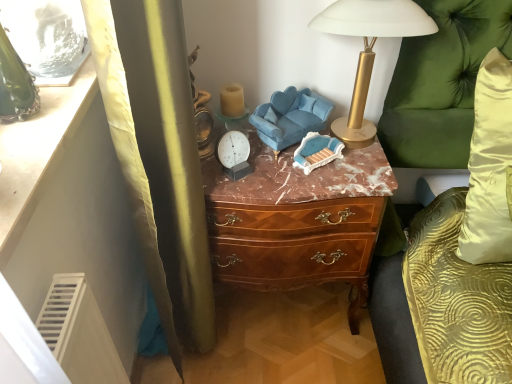
Measure the distance between point (423, 13) and camera.

The distance of point (423, 13) from camera is 3.41 feet.

At what (x,y) coordinates should I click in order to perform the action: click on gold metallic lamp at upper right. Please return your answer as a coordinate pair (x, y). The height and width of the screenshot is (384, 512). Looking at the image, I should click on (368, 50).

The image size is (512, 384). What do you see at coordinates (441, 83) in the screenshot? I see `green velvet couch at right` at bounding box center [441, 83].

Measure the distance between point (x=438, y=161) and camera.

Point (x=438, y=161) is 4.24 feet from camera.

Measure the distance between point [343,200] and camera.

The distance of point [343,200] from camera is 1.10 meters.

The width and height of the screenshot is (512, 384). I want to click on matte white vanity at upper left, so [x=70, y=209].

Where is `gold metallic lamp at upper right`? The height and width of the screenshot is (384, 512). gold metallic lamp at upper right is located at coordinates (368, 50).

Between velvet blue swivel chair at center and gold metallic lamp at upper right, which one has larger size?

gold metallic lamp at upper right is bigger.

From a real-world perspective, which is physically above, velvet blue swivel chair at center or gold metallic lamp at upper right?

From a 3D spatial view, gold metallic lamp at upper right is above.

Would you consider velvet blue swivel chair at center to be distant from gold metallic lamp at upper right?

velvet blue swivel chair at center is actually quite close to gold metallic lamp at upper right.

Which is behind, point (283, 111) or point (337, 17)?

Point (283, 111)

From a real-world perspective, is matte white vanity at upper left positioned above or below velvet blue swivel chair at center?

matte white vanity at upper left is situated higher than velvet blue swivel chair at center in the real world.

Which is less distant, (45, 290) or (266, 139)?

Clearly, point (45, 290) is closer to the camera than point (266, 139).

Between matte white vanity at upper left and velvet blue swivel chair at center, which one is positioned behind?

velvet blue swivel chair at center is further from the camera.

Which is more to the right, matte white vanity at upper left or velvet blue swivel chair at center?

Positioned to the right is velvet blue swivel chair at center.

Is matte white vanity at upper left looking in the opposite direction of green velvet couch at right?

matte white vanity at upper left is not turned away from green velvet couch at right.

Which object is closer to the camera, matte white vanity at upper left or green velvet couch at right?

Positioned in front is matte white vanity at upper left.

From a real-world perspective, does matte white vanity at upper left sit lower than green velvet couch at right?

No, from a real-world perspective, matte white vanity at upper left is not beneath green velvet couch at right.

Can you tell me how much matte white vanity at upper left and green velvet couch at right differ in facing direction?

The angular difference between matte white vanity at upper left and green velvet couch at right is 87.6 degrees.

From a real-world perspective, is green velvet couch at right on velvet blue swivel chair at center?

No.

Is point (430, 116) more distant than point (285, 144)?

Yes, it is behind point (285, 144).

Is velvet blue swivel chair at center surrounded by green velvet couch at right?

Definitely not — velvet blue swivel chair at center is not inside green velvet couch at right.

Consider the image. Which object is positioned more to the right, green velvet couch at right or velvet blue swivel chair at center?

green velvet couch at right is more to the right.

Does green velvet couch at right have a smaller size compared to brown wood chest of drawers at center?

Correct, green velvet couch at right occupies less space than brown wood chest of drawers at center.

From the picture: Who is taller, green velvet couch at right or brown wood chest of drawers at center?

green velvet couch at right.

From the image's perspective, is green velvet couch at right above or below brown wood chest of drawers at center?

green velvet couch at right is above brown wood chest of drawers at center.

Does green velvet couch at right appear on the right side of brown wood chest of drawers at center?

Indeed, green velvet couch at right is positioned on the right side of brown wood chest of drawers at center.

Is velvet blue swivel chair at center turned away from brown wood chest of drawers at center?

No, velvet blue swivel chair at center is not facing the opposite direction of brown wood chest of drawers at center.

Can you confirm if velvet blue swivel chair at center is bigger than brown wood chest of drawers at center?

No, velvet blue swivel chair at center is not bigger than brown wood chest of drawers at center.

Can you confirm if velvet blue swivel chair at center is taller than brown wood chest of drawers at center?

In fact, velvet blue swivel chair at center may be shorter than brown wood chest of drawers at center.

Identify the location of swivel chair behind the brown wood chest of drawers at center. (290, 117).

Is brown wood chest of drawers at center surrounded by matte white vanity at upper left?

No, brown wood chest of drawers at center is not surrounded by matte white vanity at upper left.

Is point (35, 161) positioned before point (343, 256)?

Yes, it is in front of point (343, 256).

Based on the photo, from the image's perspective, does matte white vanity at upper left appear lower than brown wood chest of drawers at center?

No, from the image's perspective, matte white vanity at upper left is not beneath brown wood chest of drawers at center.

In the image, there is a gold metallic lamp at upper right. Identify the location of swivel chair below it (from the image's perspective). (290, 117).

Image resolution: width=512 pixels, height=384 pixels. I want to click on swivel chair on the right side of matte white vanity at upper left, so click(290, 117).

Considering their positions, is brown wood chest of drawers at center positioned closer to velvet blue swivel chair at center than gold metallic lamp at upper right?

gold metallic lamp at upper right is closer to velvet blue swivel chair at center.

Based on the photo, which object lies nearer to the anchor point green velvet couch at right, matte white vanity at upper left or gold metallic lamp at upper right?

Among the two, gold metallic lamp at upper right is located nearer to green velvet couch at right.

Which object lies further to the anchor point matte white vanity at upper left, gold metallic lamp at upper right or velvet blue swivel chair at center?

Based on the image, gold metallic lamp at upper right appears to be further to matte white vanity at upper left.

Looking at the image, which one is located closer to brown wood chest of drawers at center, velvet blue swivel chair at center or gold metallic lamp at upper right?

velvet blue swivel chair at center.

Estimate the real-world distances between objects in this image. Which object is further from gold metallic lamp at upper right, velvet blue swivel chair at center or matte white vanity at upper left?

Among the two, matte white vanity at upper left is located further to gold metallic lamp at upper right.

Estimate the real-world distances between objects in this image. Which object is closer to gold metallic lamp at upper right, brown wood chest of drawers at center or matte white vanity at upper left?

The object closer to gold metallic lamp at upper right is brown wood chest of drawers at center.

Estimate the real-world distances between objects in this image. Which object is closer to gold metallic lamp at upper right, green velvet couch at right or matte white vanity at upper left?

green velvet couch at right.

Considering their positions, is matte white vanity at upper left positioned further to green velvet couch at right than brown wood chest of drawers at center?

Among the two, matte white vanity at upper left is located further to green velvet couch at right.

This screenshot has width=512, height=384. What are the coordinates of `lamp between matte white vanity at upper left and green velvet couch at right from left to right` in the screenshot? It's located at (368, 50).

Where is `chest of drawers between velvet blue swivel chair at center and green velvet couch at right from left to right`? This screenshot has width=512, height=384. chest of drawers between velvet blue swivel chair at center and green velvet couch at right from left to right is located at coordinates (297, 221).

Locate an element on the screen. This screenshot has width=512, height=384. swivel chair situated between matte white vanity at upper left and brown wood chest of drawers at center from left to right is located at coordinates (290, 117).

Where is `the chest of drawers situated between matte white vanity at upper left and green velvet couch at right from left to right`? This screenshot has height=384, width=512. the chest of drawers situated between matte white vanity at upper left and green velvet couch at right from left to right is located at coordinates (x=297, y=221).